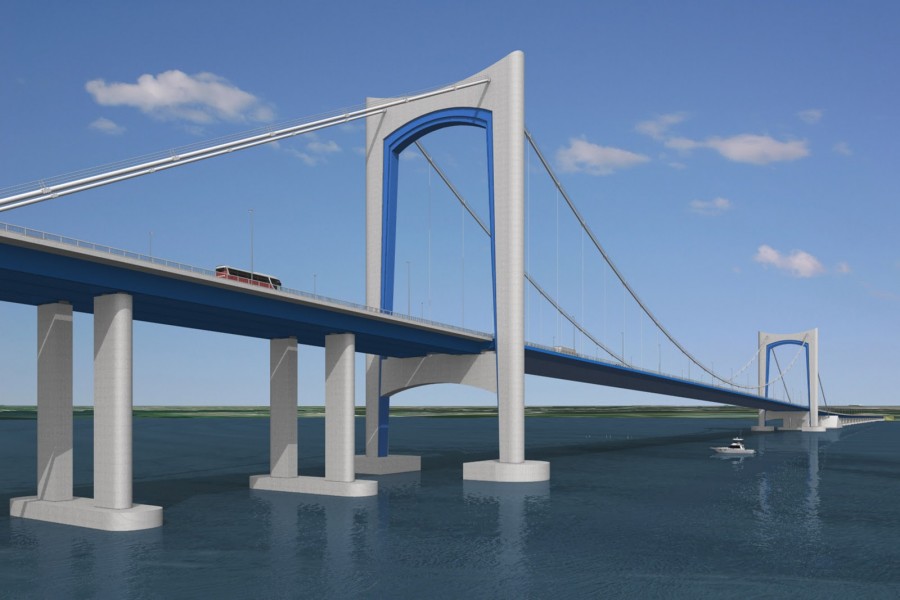
Identify the location of window. (236, 275).